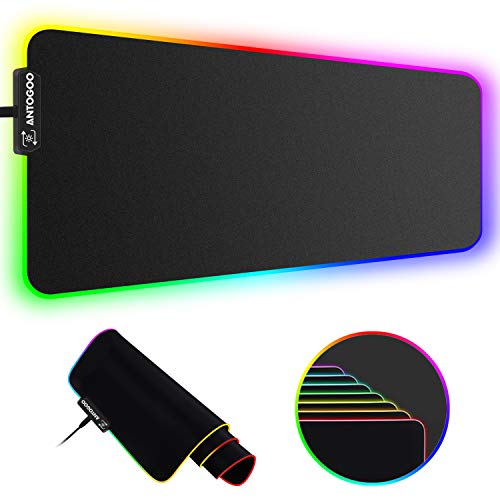
Find the location of `cable`. cable is located at coordinates (82, 423).